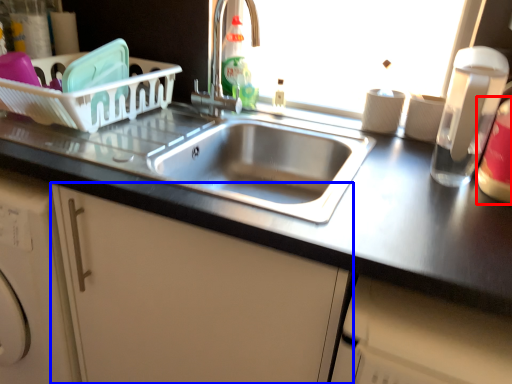
Question: Which point is further to the camera, bottle (highlighted by a red box) or cabinetry (highlighted by a blue box)?

Choices:
 (A) bottle
 (B) cabinetry

Answer: (A)